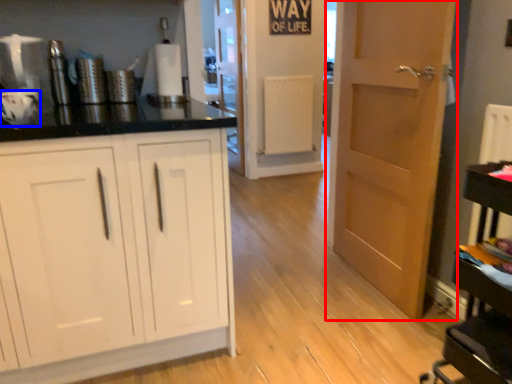
Question: Among these objects, which one is farthest to the camera, door (highlighted by a red box) or appliance (highlighted by a blue box)?

Choices:
 (A) door
 (B) appliance

Answer: (A)